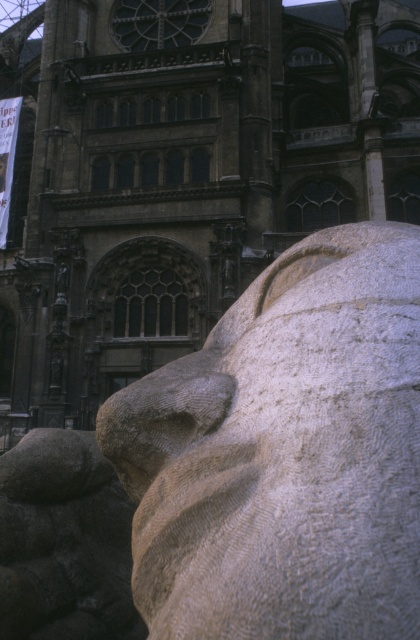
Based on the provided image, where exactly is the dark stone church at center located in terms of its 2D coordinates?

The dark stone church at center is located at the 2D coordinates of point [183,173].

You are standing in front of the dark stone church at center and the white stone lion at center. Which one is positioned more to the left side?

The dark stone church at center is positioned more to the left than the white stone lion at center.